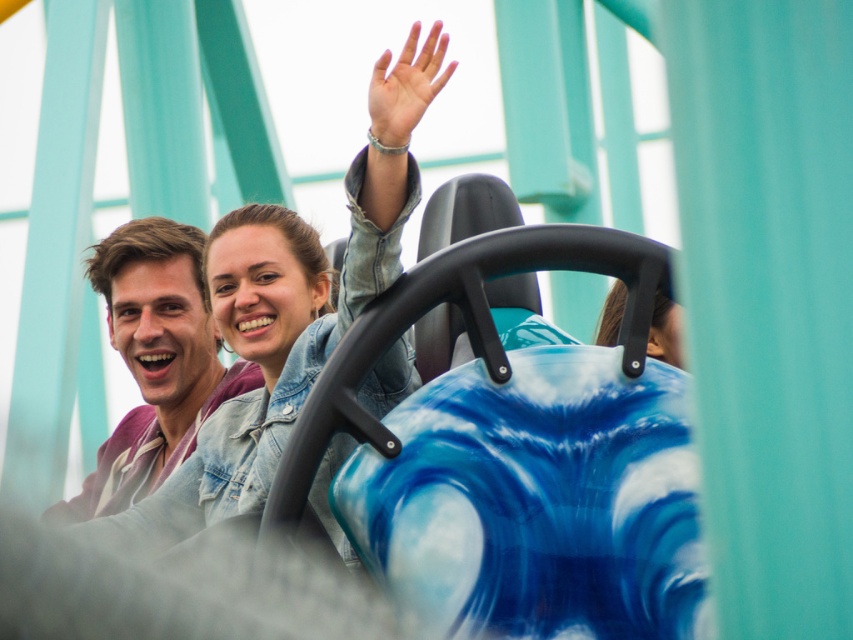
Between point (173, 515) and point (96, 464), which one is positioned in front?

Positioned in front is point (173, 515).

Is point (262, 467) positioned behind point (201, 314)?

No, it is not.

Is point (244, 256) positioned in front of point (131, 461)?

Yes.

The width and height of the screenshot is (853, 640). Find the location of `denim jacket at upper center`. denim jacket at upper center is located at coordinates (289, 308).